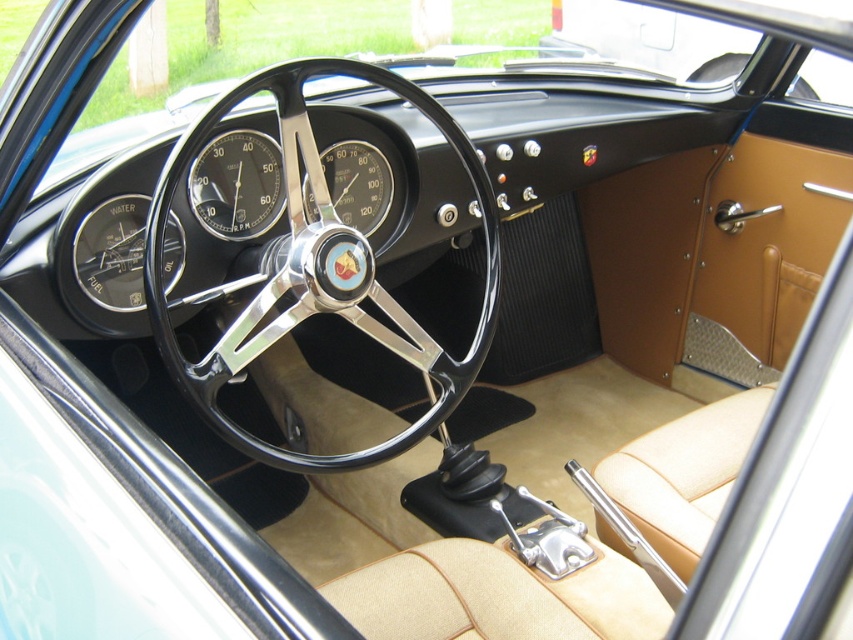
Question: Which point is closer to the camera?

Choices:
 (A) matte black gauge at center
 (B) black rubber speedometer at center
 (C) black chrome steering wheel at center

Answer: (C)

Question: Considering the relative positions of matte black gauge at center and black rubber speedometer at center in the image provided, where is matte black gauge at center located with respect to black rubber speedometer at center?

Choices:
 (A) right
 (B) left

Answer: (B)

Question: Can you confirm if black chrome steering wheel at center is positioned to the right of matte black gauge at center?

Choices:
 (A) no
 (B) yes

Answer: (B)

Question: Is black chrome steering wheel at center positioned in front of matte black gauge at center?

Choices:
 (A) yes
 (B) no

Answer: (A)

Question: Among these objects, which one is farthest from the camera?

Choices:
 (A) matte black gauge at center
 (B) black rubber speedometer at center

Answer: (B)

Question: Estimate the real-world distances between objects in this image. Which object is farther from the black rubber speedometer at center?

Choices:
 (A) black chrome steering wheel at center
 (B) matte black gauge at center

Answer: (A)